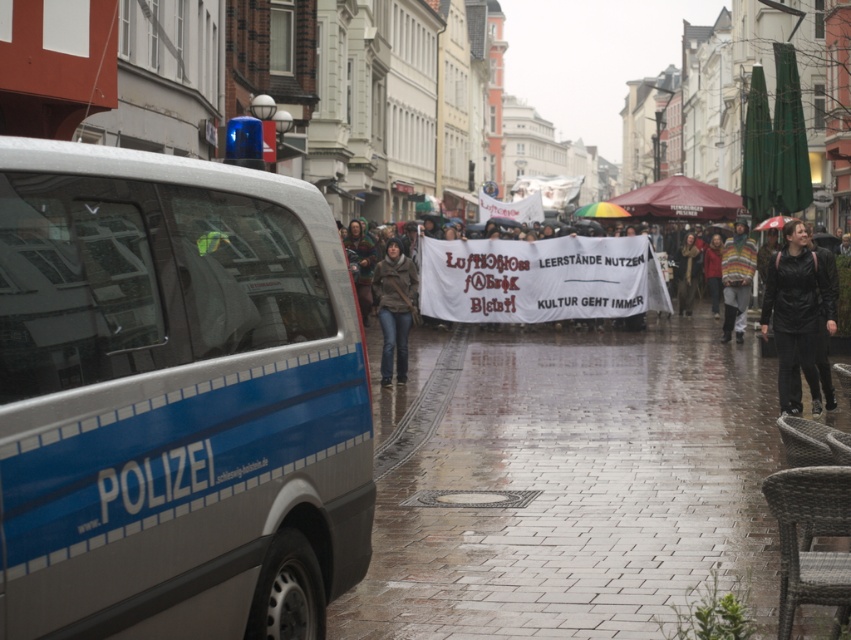
Question: Which point is closer to the camera?

Choices:
 (A) striped sweater at center
 (B) brown leather jacket at center
 (C) silver metallic van at left
 (D) gray brick pavement at center

Answer: (C)

Question: Is silver metallic van at left in front of brown leather jacket at center?

Choices:
 (A) no
 (B) yes

Answer: (B)

Question: Does gray brick pavement at center appear under striped sweater at center?

Choices:
 (A) yes
 (B) no

Answer: (A)

Question: Which object is positioned closest to the gray brick pavement at center?

Choices:
 (A) white fabric banner at center
 (B) black leather jacket at right
 (C) brown leather jacket at center
 (D) striped sweater at center

Answer: (B)

Question: Which object is closer to the camera taking this photo?

Choices:
 (A) striped sweater at center
 (B) white fabric banner at center
 (C) silver metallic van at left

Answer: (C)

Question: Can you confirm if silver metallic van at left is positioned above black leather jacket at right?

Choices:
 (A) no
 (B) yes

Answer: (A)